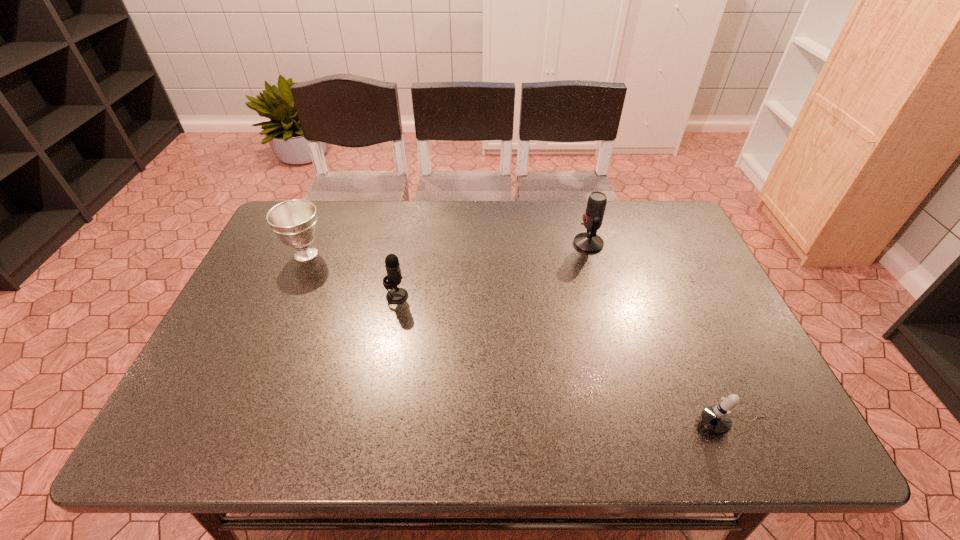
Identify the location of free region located on the right of the chalice. (442, 254).

Image resolution: width=960 pixels, height=540 pixels. Find the location of `vacant point located 0.370m on the back of the leftmost microphone`. vacant point located 0.370m on the back of the leftmost microphone is located at coordinates (413, 210).

Locate an element on the screen. This screenshot has width=960, height=540. free location located 0.280m on the back of the shortest microphone is located at coordinates (684, 314).

Where is `microphone located at the far edge`? This screenshot has width=960, height=540. microphone located at the far edge is located at coordinates (589, 242).

The image size is (960, 540). What are the coordinates of `chalice that is positioned at the far edge` in the screenshot? It's located at (294, 222).

The height and width of the screenshot is (540, 960). Find the location of `object present at the near edge`. object present at the near edge is located at coordinates (716, 419).

At what (x,y) coordinates should I click in order to perform the action: click on object present at the left edge. Please return your answer as a coordinate pair (x, y). Image resolution: width=960 pixels, height=540 pixels. Looking at the image, I should click on (294, 222).

What are the coordinates of `object that is positioned at the right edge` in the screenshot? It's located at (716, 419).

Locate an element on the screen. Image resolution: width=960 pixels, height=540 pixels. object located at the far left corner is located at coordinates (294, 222).

Where is `object present at the near right corner`? The width and height of the screenshot is (960, 540). object present at the near right corner is located at coordinates (716, 419).